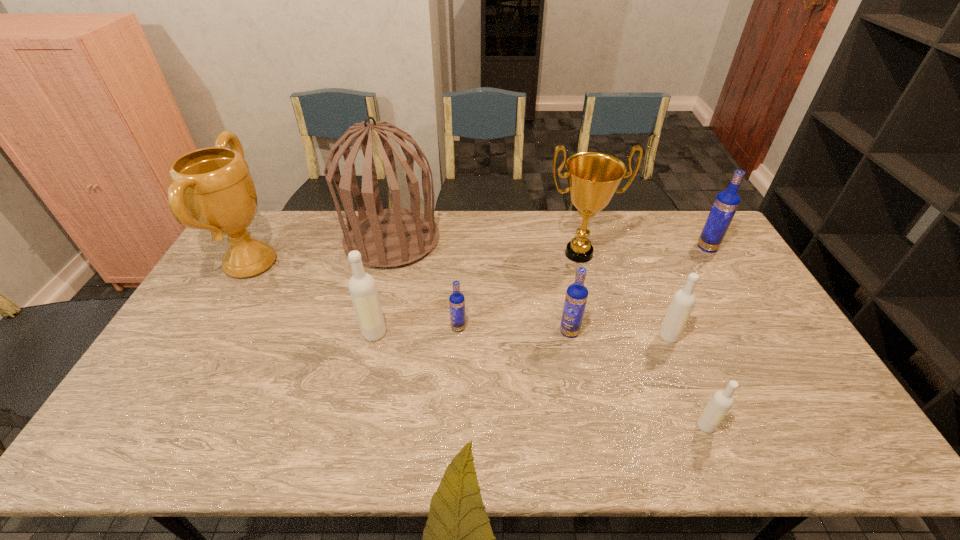
Locate an element on the screen. the second vodka from left to right is located at coordinates (456, 300).

At what (x,y) coordinates should I click in order to perform the action: click on the leftmost blue vodka. Please return your answer as a coordinate pair (x, y). The width and height of the screenshot is (960, 540). Looking at the image, I should click on (456, 300).

The height and width of the screenshot is (540, 960). Find the location of `the smallest white vodka`. the smallest white vodka is located at coordinates (721, 402).

I want to click on the nearest vodka, so click(721, 402).

Identify the location of free region located 0.160m on the left of the brown birdcage. This screenshot has width=960, height=540. (300, 240).

Where is `free space located 0.250m on the front view with handles of the gold award`? Image resolution: width=960 pixels, height=540 pixels. free space located 0.250m on the front view with handles of the gold award is located at coordinates (598, 328).

Identify the location of vacant space situated 0.230m on the front of the leftmost object with the decoration. The width and height of the screenshot is (960, 540). (348, 264).

The height and width of the screenshot is (540, 960). Find the location of `free space located on the back of the rightmost object`. free space located on the back of the rightmost object is located at coordinates pos(690,219).

What are the coordinates of `vacant area located on the back of the biggest white vodka` in the screenshot? It's located at (394, 249).

The image size is (960, 540). What are the coordinates of `vacant point located 0.190m on the right of the second smallest white vodka` in the screenshot? It's located at (745, 336).